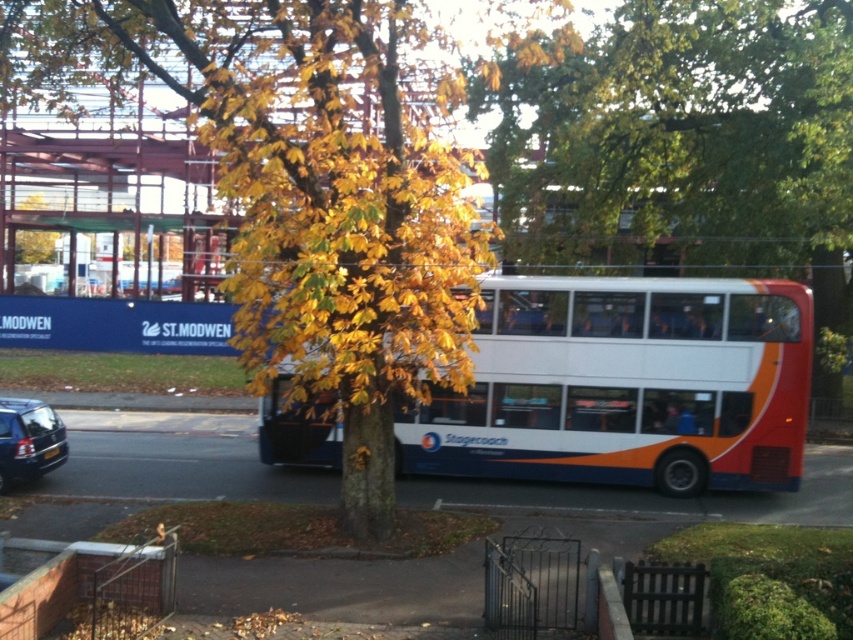
You are a passenger on the white orange and blue stagecoach bus at center. You want to get off at the next stop. The bus driver tells you that the stop is located at the point with coordinates (625, 385). Can you confirm if this stop is near the tree in front of the bus?

The point (625, 385) indicates the white orange blue stagecoach bus at center, so the stop is actually located at the bus itself, not near the tree in front of the bus.